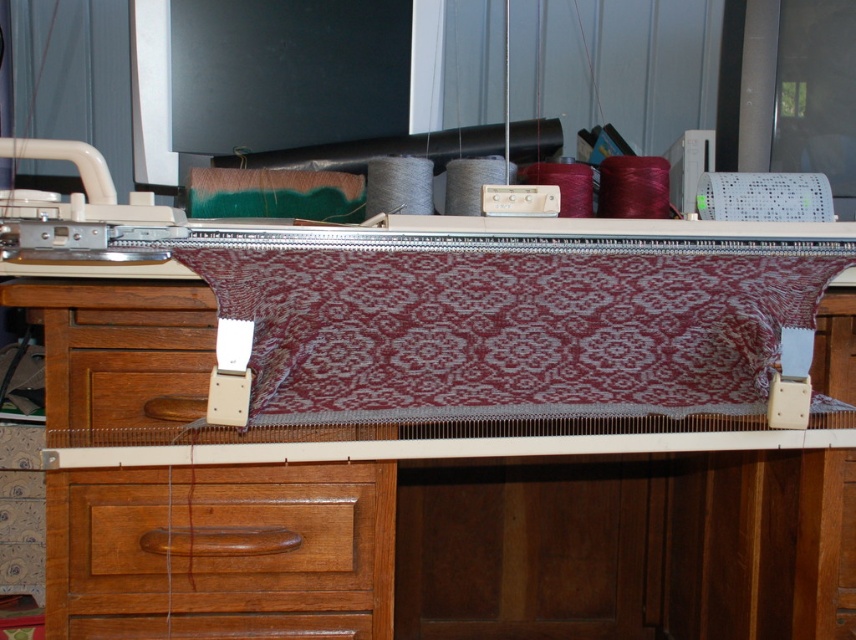
Question: Is the position of wooden table at center more distant than that of wooden drawer at lower left?

Choices:
 (A) yes
 (B) no

Answer: (B)

Question: Observing the image, what is the correct spatial positioning of wooden table at center in reference to wooden drawer at lower left?

Choices:
 (A) right
 (B) left

Answer: (A)

Question: Which object is closer to the camera taking this photo?

Choices:
 (A) wooden table at center
 (B) maroon fabric at center
 (C) wooden drawer at lower left

Answer: (B)

Question: Which point is farther from the camera taking this photo?

Choices:
 (A) tap(174, 621)
 (B) tap(328, 310)

Answer: (A)

Question: Based on their relative distances, which object is farther from the maroon fabric at center?

Choices:
 (A) wooden table at center
 (B) wooden drawer at lower left

Answer: (B)

Question: Is wooden table at center below maroon fabric at center?

Choices:
 (A) no
 (B) yes

Answer: (B)